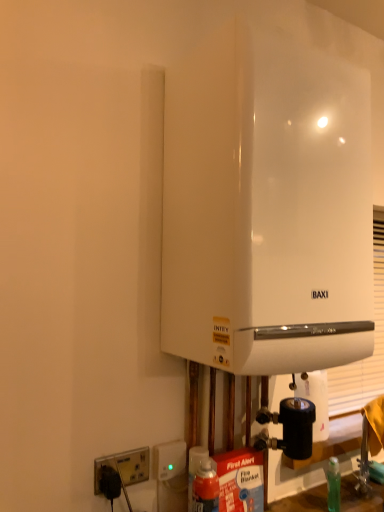
Question: Considering the relative sizes of white matte paper towel at lower right and white glossy boiler at center in the image provided, is white matte paper towel at lower right smaller than white glossy boiler at center?

Choices:
 (A) yes
 (B) no

Answer: (A)

Question: Is white matte paper towel at lower right looking in the opposite direction of white glossy boiler at center?

Choices:
 (A) no
 (B) yes

Answer: (A)

Question: From the image's perspective, is white matte paper towel at lower right located beneath white glossy boiler at center?

Choices:
 (A) no
 (B) yes

Answer: (B)

Question: From a real-world perspective, is white matte paper towel at lower right positioned over white glossy boiler at center based on gravity?

Choices:
 (A) no
 (B) yes

Answer: (A)

Question: Is white matte paper towel at lower right thinner than white glossy boiler at center?

Choices:
 (A) yes
 (B) no

Answer: (A)

Question: Would you say white glossy boiler at center is part of white matte paper towel at lower right's contents?

Choices:
 (A) no
 (B) yes

Answer: (A)

Question: Considering the relative positions of white plastic socket at lower left, placed as the first electric outlet when sorted from left to right, and white glossy boiler at center in the image provided, is white plastic socket at lower left, placed as the first electric outlet when sorted from left to right, to the right of white glossy boiler at center from the viewer's perspective?

Choices:
 (A) no
 (B) yes

Answer: (A)

Question: Is the depth of white plastic socket at lower left, arranged as the second electric outlet when viewed from the right, less than that of white glossy boiler at center?

Choices:
 (A) no
 (B) yes

Answer: (A)

Question: Is the depth of white plastic socket at lower left, placed as the first electric outlet when sorted from left to right, greater than that of white glossy boiler at center?

Choices:
 (A) no
 (B) yes

Answer: (B)

Question: Is white plastic socket at lower left, arranged as the second electric outlet when viewed from the right, taller than white glossy boiler at center?

Choices:
 (A) no
 (B) yes

Answer: (A)

Question: Is white plastic socket at lower left, placed as the first electric outlet when sorted from left to right, touching white glossy boiler at center?

Choices:
 (A) yes
 (B) no

Answer: (B)

Question: From the image's perspective, does white plastic socket at lower left, placed as the first electric outlet when sorted from left to right, appear lower than white glossy boiler at center?

Choices:
 (A) no
 (B) yes

Answer: (B)

Question: Is white plastic socket at lower left, the 1th electric outlet in the right-to-left sequence, facing away from white plastic socket at lower left, placed as the first electric outlet when sorted from left to right?

Choices:
 (A) no
 (B) yes

Answer: (A)